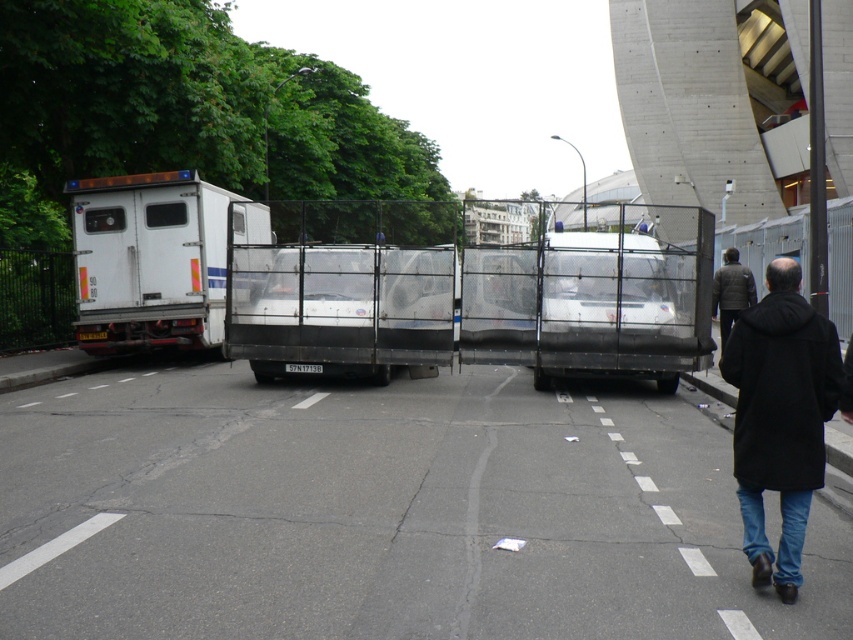
You are a delivery driver who needs to park your truck in a tight alleyway between the metallic silver trailer truck at center and the white matte truck at left. Can you safely navigate through the space between them without hitting either vehicle?

The metallic silver trailer truck at center is positioned under the white matte truck at left, which means they are stacked vertically rather than side by side. Since they are not parked next to each other horizontally, there is no space between them for your truck to pass through. You would need to find an alternative route or reposition the vehicles to create a horizontal passage.

You are a delivery driver trying to park your truck in a specific spot marked at coordinates point A. The metallic silver trailer truck at center is currently blocking the way. Based on its position, can you estimate whether the truck is positioned closer to point A or farther away from it?

The metallic silver trailer truck at center is located at point A, so it is exactly at the target coordinates and blocking the spot completely.

You are a pedestrian standing on the sidewalk and want to cross the street. There are two vehicles in front of you, a metallic silver trailer truck at center and a black matte coat at lower right. Which vehicle should you avoid walking too close to because it is bigger?

The metallic silver trailer truck at center is larger in size than the black matte coat at lower right, so you should avoid walking too close to the metallic silver trailer truck at center.